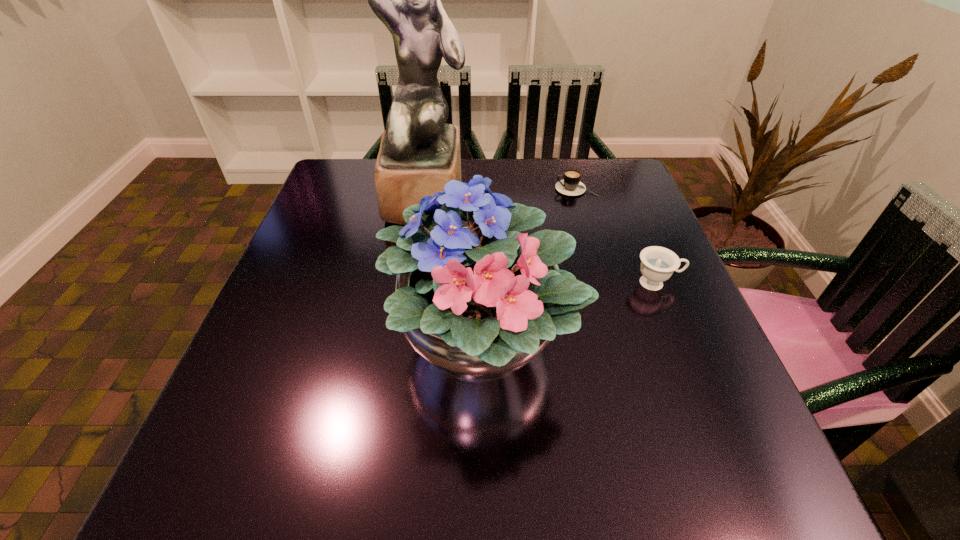
Find the location of a particular element. Image resolution: width=960 pixels, height=540 pixels. sculpture is located at coordinates (419, 153).

The width and height of the screenshot is (960, 540). I want to click on bouquet, so click(480, 302).

Where is `teacup`? teacup is located at coordinates (657, 265).

Find the location of a particular element. This screenshot has height=540, width=960. the second shortest object is located at coordinates (657, 265).

Identify the location of cappuccino. (571, 185).

Locate an element on the screen. the shortest object is located at coordinates (571, 185).

Where is `blank area located 0.090m in a relaxed pose on the tallest object`? The width and height of the screenshot is (960, 540). blank area located 0.090m in a relaxed pose on the tallest object is located at coordinates (418, 253).

Image resolution: width=960 pixels, height=540 pixels. Find the location of `vacant space located on the right of the third shortest object`. vacant space located on the right of the third shortest object is located at coordinates coord(675,341).

Locate an element on the screen. This screenshot has height=540, width=960. vacant point located 0.120m with the handle on the side of the cappuccino is located at coordinates (511, 189).

In order to click on vacant point located with the handle on the side of the cappuccino in this screenshot , I will do `click(440, 189)`.